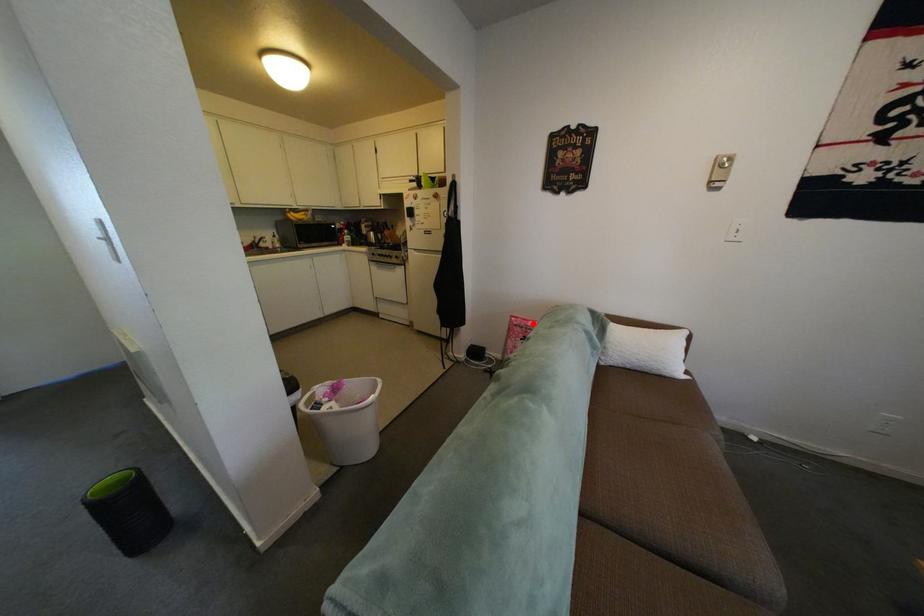
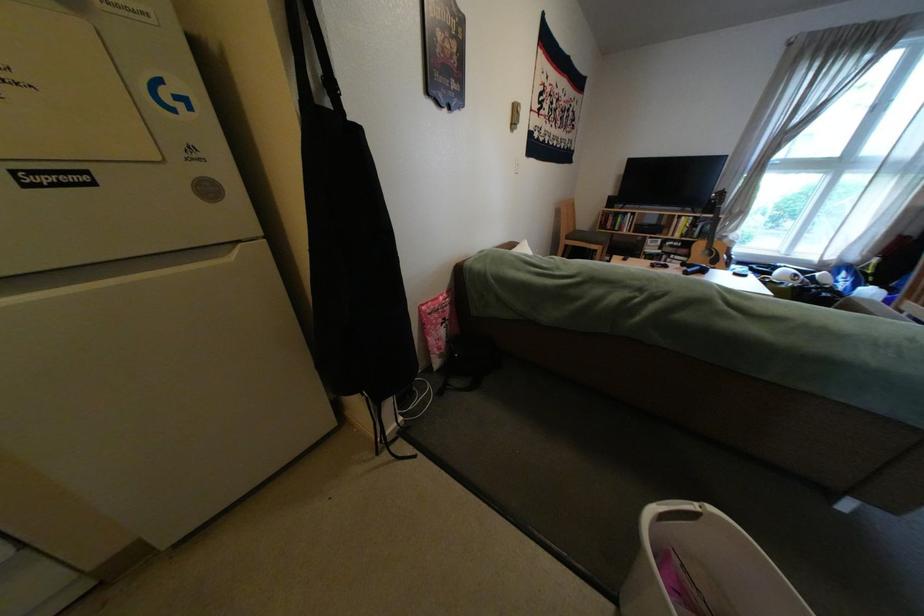
Locate, in the second image, the point that corresponds to the highlighted location in the first image.

(446, 309)